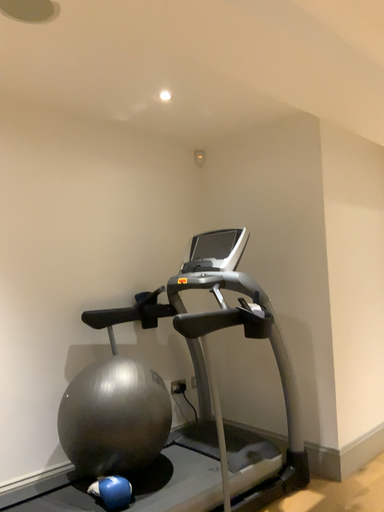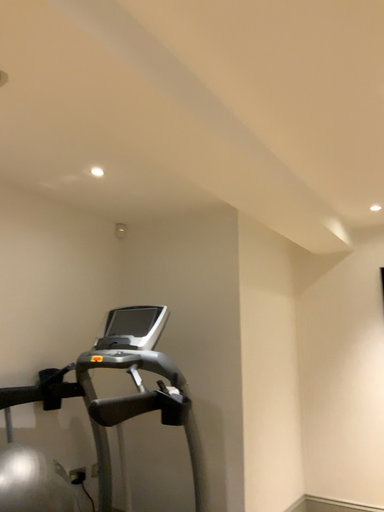
Question: How did the camera likely rotate when shooting the video?

Choices:
 (A) rotated downward
 (B) rotated upward

Answer: (B)